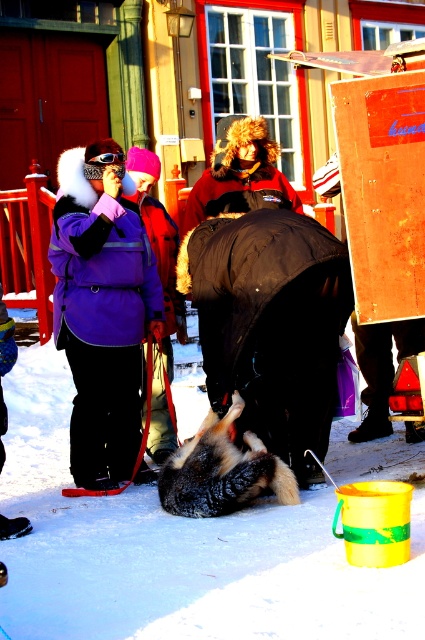
What do you see at coordinates (175, 552) in the screenshot?
I see `white fluffy snow at center` at bounding box center [175, 552].

Is white fluffy snow at center behind brown fur dog at center?

Yes, it is behind brown fur dog at center.

Locate an element on the screen. This screenshot has height=640, width=425. white fluffy snow at center is located at coordinates (175, 552).

Find the location of `white fluffy snow at center`. white fluffy snow at center is located at coordinates (175, 552).

Is white fluffy snow at center smaller than brown fur hat at center?

Incorrect, white fluffy snow at center is not smaller in size than brown fur hat at center.

Does white fluffy snow at center have a lesser height compared to brown fur hat at center?

Yes.

Consider the image. Who is more distant from viewer, (180, 620) or (275, 156)?

Point (275, 156)

This screenshot has width=425, height=640. In order to click on white fluffy snow at center in this screenshot , I will do `click(175, 552)`.

Can you confirm if white fluffy snow at center is bigger than purple fleece jacket at upper left?

No.

The width and height of the screenshot is (425, 640). Find the location of `white fluffy snow at center`. white fluffy snow at center is located at coordinates (175, 552).

Where is `white fluffy snow at center`? This screenshot has width=425, height=640. white fluffy snow at center is located at coordinates (175, 552).